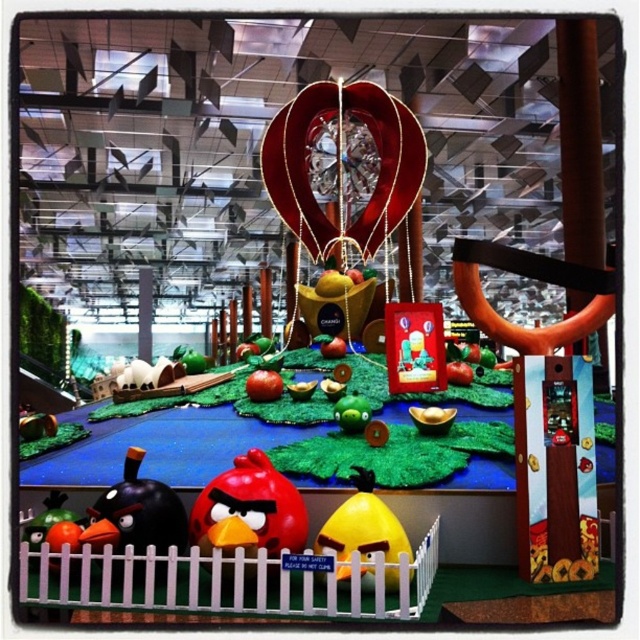
You are a visitor at the Angry Birds themed attraction and want to take a photo of the matte black bird at lower left and the red matte apple at center. From which direction should you stand to ensure both objects are visible in your frame?

You should stand in a position where the matte black bird at lower left is not blocked by the red matte apple at center, as the matte black bird is positioned under the red matte apple at center.

You are a visitor at the Angry Birds themed attraction and want to take a photo of the matte black bird at lower left and the red matte apple at center. Which object should you frame first in your camera viewfinder to ensure both are in the shot?

You should frame the matte black bird at lower left first since it is positioned to the left of the red matte apple at center, ensuring both are included in the photo.